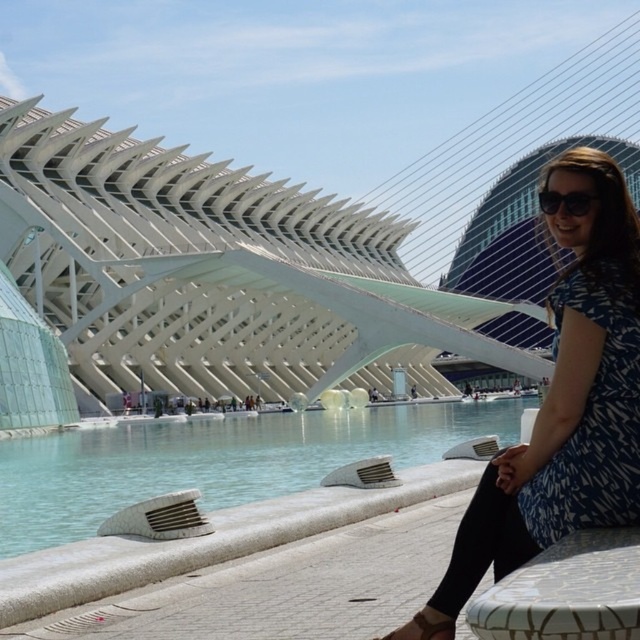
Between point (618, 307) and point (362, 518), which one is positioned in front?

Point (618, 307)

From the picture: Who is more forward, [598,396] or [204,560]?

Point [598,396] is in front.

What are the coordinates of `blue printed dress at center` in the screenshot? It's located at (568, 397).

Who is lower down, blue printed dress at center or brown leather sandal at lower center?

brown leather sandal at lower center is lower down.

Which is behind, point (449, 609) or point (436, 614)?

The point (449, 609) is more distant.

You are a GUI agent. You are given a task and a screenshot of the screen. Output one action in this format:
    pyautogui.click(x=<x>, y=<y>)
    Task: Click on the blue printed dress at center
    Image resolution: width=640 pixels, height=640 pixels.
    Given the screenshot: What is the action you would take?
    pyautogui.click(x=568, y=397)

Is blue printed dress at center positioned before blue printed dress at lower right?

Yes, blue printed dress at center is closer to the viewer.

Between blue printed dress at center and blue printed dress at lower right, which one is positioned lower?

blue printed dress at lower right is below.

Which is behind, point (556, 179) or point (576, 520)?

The point (556, 179) is behind.

Locate an element on the screen. blue printed dress at center is located at coordinates (568, 397).